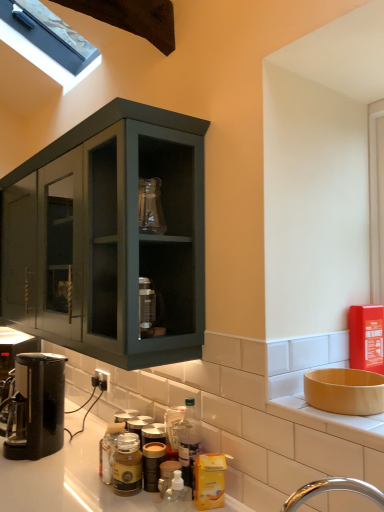
Question: Is black plastic coffee machine at lower left, the second coffee machine positioned from the front, completely or partially outside of translucent plastic bottle at lower center, marked as the first bottle in a back-to-front arrangement?

Choices:
 (A) no
 (B) yes

Answer: (B)

Question: From a real-world perspective, is black plastic coffee machine at lower left, positioned as the first coffee machine in left-to-right order, physically below translucent plastic bottle at lower center, which is the third bottle from left to right?

Choices:
 (A) yes
 (B) no

Answer: (B)

Question: Can you confirm if black plastic coffee machine at lower left, positioned as the first coffee machine in left-to-right order, is bigger than translucent plastic bottle at lower center, which is the third bottle from left to right?

Choices:
 (A) no
 (B) yes

Answer: (B)

Question: Is black plastic coffee machine at lower left, positioned as the first coffee machine in back-to-front order, taller than translucent plastic bottle at lower center, marked as the first bottle in a back-to-front arrangement?

Choices:
 (A) no
 (B) yes

Answer: (B)

Question: Is black plastic coffee machine at lower left, positioned as the first coffee machine in back-to-front order, positioned in front of translucent plastic bottle at lower center, placed as the 4th bottle when sorted from front to back?

Choices:
 (A) yes
 (B) no

Answer: (B)

Question: Which is correct: translucent plastic bottle at lower center, the 4th bottle from the back, is inside matte glass jar at center, arranged as the 2th bottle when viewed from the back, or outside of it?

Choices:
 (A) inside
 (B) outside

Answer: (B)

Question: From the image's perspective, relative to matte glass jar at center, arranged as the 2th bottle when viewed from the back, is translucent plastic bottle at lower center, the 4th bottle from the back, above or below?

Choices:
 (A) below
 (B) above

Answer: (B)

Question: From a real-world perspective, is translucent plastic bottle at lower center, placed as the 2th bottle when sorted from left to right, above or below matte glass jar at center, which is the 3th bottle in front-to-back order?

Choices:
 (A) below
 (B) above

Answer: (B)

Question: In the image, is translucent plastic bottle at lower center, the 3th bottle positioned from the right, positioned in front of or behind matte glass jar at center, positioned as the 4th bottle in right-to-left order?

Choices:
 (A) behind
 (B) front

Answer: (B)

Question: In terms of height, does matte glass jar at center, positioned as the 4th bottle in right-to-left order, look taller or shorter compared to translucent plastic bottle at lower center, which is the third bottle from left to right?

Choices:
 (A) short
 (B) tall

Answer: (A)

Question: Would you say matte glass jar at center, marked as the first bottle in a left-to-right arrangement, is inside or outside translucent plastic bottle at lower center, placed as the 4th bottle when sorted from front to back?

Choices:
 (A) outside
 (B) inside

Answer: (A)

Question: From the image's perspective, is matte glass jar at center, marked as the first bottle in a left-to-right arrangement, positioned above or below translucent plastic bottle at lower center, placed as the 4th bottle when sorted from front to back?

Choices:
 (A) above
 (B) below

Answer: (B)

Question: Is matte glass jar at center, which is the 3th bottle in front-to-back order, in front of or behind translucent plastic bottle at lower center, placed as the 4th bottle when sorted from front to back, in the image?

Choices:
 (A) behind
 (B) front

Answer: (B)

Question: From a real-world perspective, relative to matte yellow bowl at right, is black plastic electric outlet at lower left vertically above or below?

Choices:
 (A) below
 (B) above

Answer: (A)

Question: Would you say black plastic electric outlet at lower left is inside or outside matte yellow bowl at right?

Choices:
 (A) outside
 (B) inside

Answer: (A)